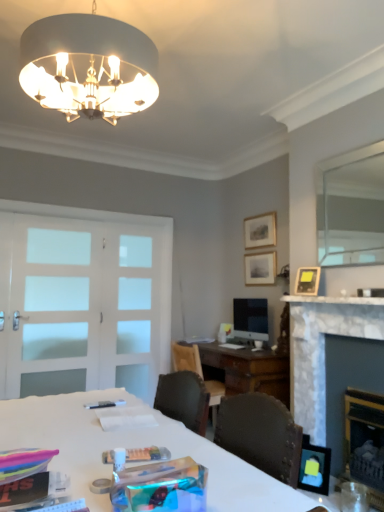
Where is `empty space that is ontop of white frosted glass door at left, the second screen door when ordered from right to left (from a real-world perspective)`? The height and width of the screenshot is (512, 384). empty space that is ontop of white frosted glass door at left, the second screen door when ordered from right to left (from a real-world perspective) is located at coordinates (67, 213).